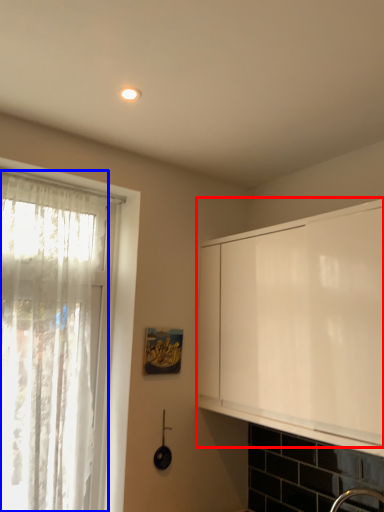
Question: Which of the following is the closest to the observer, cabinetry (highlighted by a red box) or curtain (highlighted by a blue box)?

Choices:
 (A) cabinetry
 (B) curtain

Answer: (A)